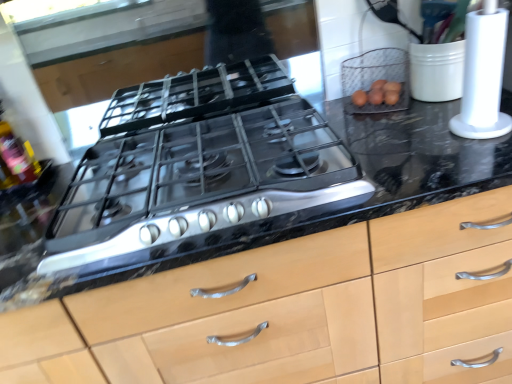
Question: Can you confirm if white plastic paper towel holder at right is wider than black marble countertop at center?

Choices:
 (A) yes
 (B) no

Answer: (B)

Question: Does white plastic paper towel holder at right have a lesser width compared to black marble countertop at center?

Choices:
 (A) no
 (B) yes

Answer: (B)

Question: Considering the relative sizes of white plastic paper towel holder at right and black marble countertop at center in the image provided, is white plastic paper towel holder at right bigger than black marble countertop at center?

Choices:
 (A) no
 (B) yes

Answer: (A)

Question: Is white plastic paper towel holder at right smaller than black marble countertop at center?

Choices:
 (A) yes
 (B) no

Answer: (A)

Question: Is white plastic paper towel holder at right closer to camera compared to black marble countertop at center?

Choices:
 (A) yes
 (B) no

Answer: (B)

Question: From the image's perspective, is white plastic paper towel holder at right under black marble countertop at center?

Choices:
 (A) yes
 (B) no

Answer: (B)

Question: From a real-world perspective, is black marble countertop at center positioned under wire mesh basket at upper right based on gravity?

Choices:
 (A) no
 (B) yes

Answer: (B)

Question: Can you confirm if black marble countertop at center is taller than wire mesh basket at upper right?

Choices:
 (A) yes
 (B) no

Answer: (A)

Question: From the image's perspective, does black marble countertop at center appear lower than wire mesh basket at upper right?

Choices:
 (A) no
 (B) yes

Answer: (B)

Question: Is black marble countertop at center next to wire mesh basket at upper right?

Choices:
 (A) no
 (B) yes

Answer: (A)

Question: From the image's perspective, would you say black marble countertop at center is positioned over wire mesh basket at upper right?

Choices:
 (A) yes
 (B) no

Answer: (B)

Question: Does black marble countertop at center appear on the left side of wire mesh basket at upper right?

Choices:
 (A) yes
 (B) no

Answer: (A)

Question: Can you confirm if white plastic paper towel holder at right is smaller than translucent plastic bottle at left?

Choices:
 (A) yes
 (B) no

Answer: (B)